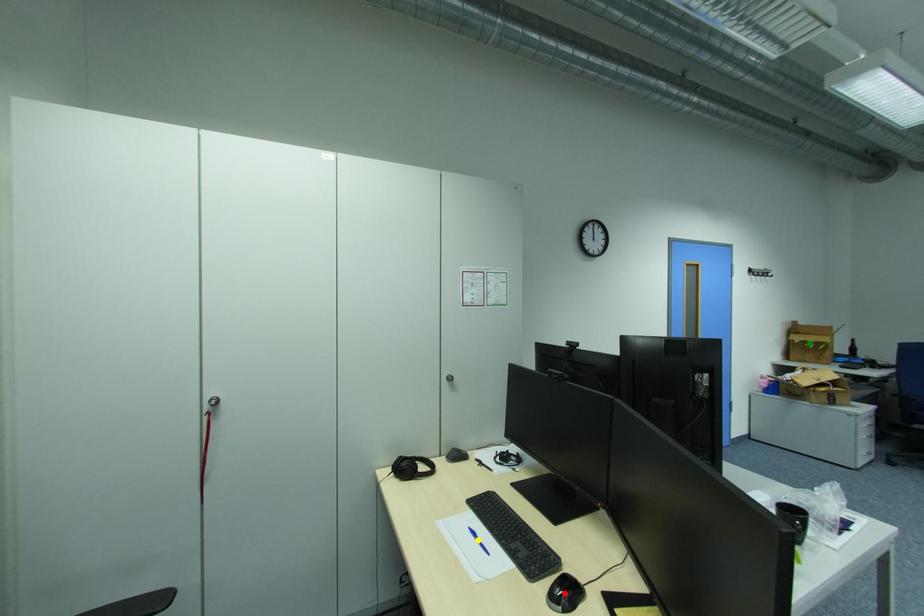
From the picture: Order these from nearest to farthest:
1. red point
2. green point
3. yellow point

red point, yellow point, green point